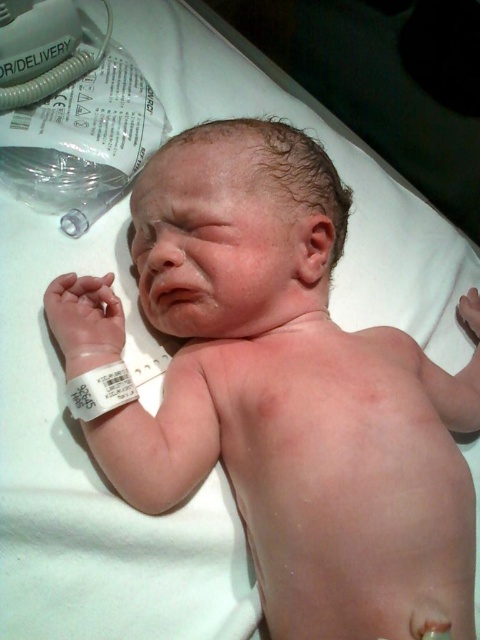
You are a nurse checking the newborn in the hospital. You need to place a new bandage on the smooth skin newborn at center. The current white plastic bandage at lower left is too small. Can the new bandage fit properly if it is the same size as the existing one?

The smooth skin newborn at center is bigger than the white plastic bandage at lower left. Since the existing bandage is too small, a new bandage of the same size would also be too small to fit properly on the newborn.

You are a nurse standing at the edge of the baby bed. You need to place a small medical device at point (180,396) on the baby. The device is 10 centimeters in diameter. Can you safely place it there without overlapping any other objects?

The point (180,396) is 77.80 centimeters away from the viewer. Since the device is only 10 centimeters in diameter, there is enough space to place it without overlapping other objects.